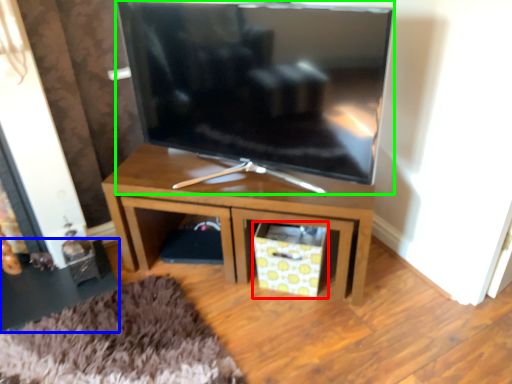
Question: Which is nearer to the drawer (highlighted by a red box)? side table (highlighted by a blue box) or television (highlighted by a green box).

Choices:
 (A) side table
 (B) television

Answer: (B)